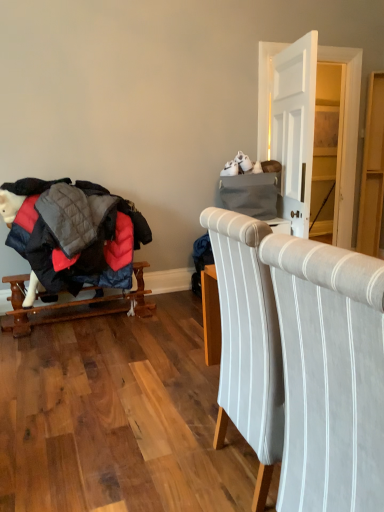
Question: From the image's perspective, relative to wooden rocking horse at left, is matte gray dresser at upper right, the 2th dresser when ordered from right to left, above or below?

Choices:
 (A) below
 (B) above

Answer: (B)

Question: From their relative heights in the image, would you say matte gray dresser at upper right, arranged as the 1th dresser when viewed from the left, is taller or shorter than wooden rocking horse at left?

Choices:
 (A) tall
 (B) short

Answer: (A)

Question: Considering the real-world distances, which object is farthest from the matte gray dresser at upper right, arranged as the 1th dresser when viewed from the left?

Choices:
 (A) light gray striped fabric chair at center
 (B) light wood dresser at right, which appears as the second dresser when viewed from the left
 (C) wooden rocking horse at left

Answer: (A)

Question: Which object is positioned closest to the matte gray dresser at upper right, the 2th dresser when ordered from right to left?

Choices:
 (A) wooden rocking horse at left
 (B) light gray striped fabric chair at center
 (C) light wood dresser at right, which appears as the second dresser when viewed from the left

Answer: (C)